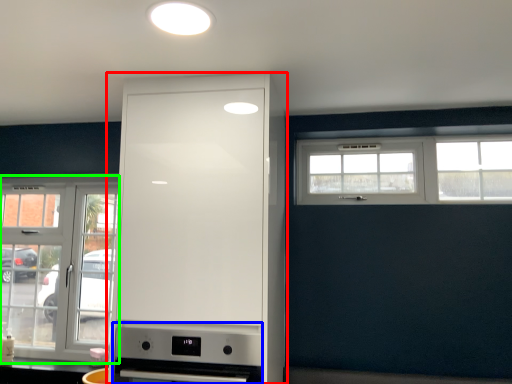
Question: Considering the real-world distances, which object is closest to cabinetry (highlighted by a red box)? appliance (highlighted by a blue box) or window (highlighted by a green box).

Choices:
 (A) appliance
 (B) window

Answer: (A)